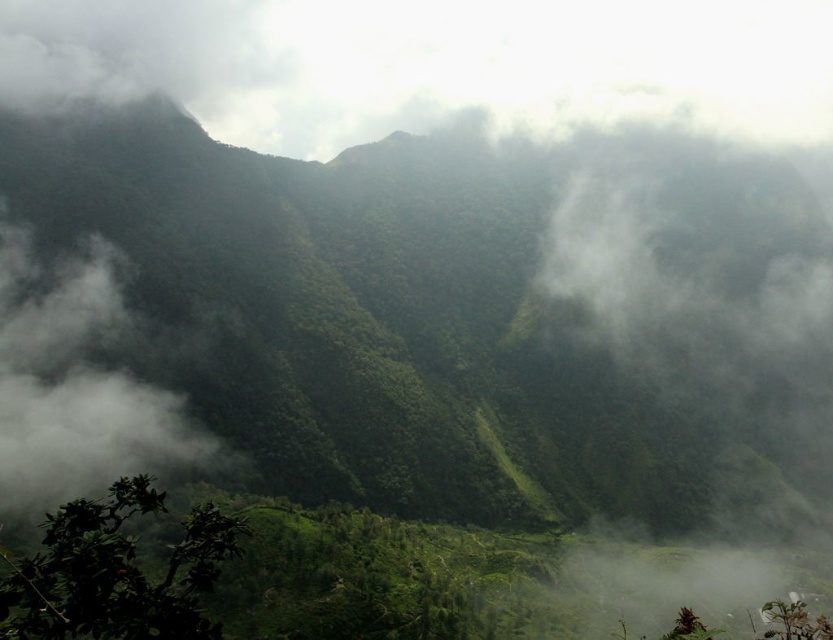
You are a hiker standing at the base of the mountain and looking towards the peak. You notice a point marked at coordinates point (x=76, y=387). What object does this point correspond to?

The point (x=76, y=387) corresponds to the white fluffy cloud at left.

You are a hiker standing at the edge of the forest looking at the white fluffy cloud at left and the green leafy bush at lower left. Which object is higher in the scene?

The white fluffy cloud at left is positioned over the green leafy bush at lower left, so it is higher in the scene.